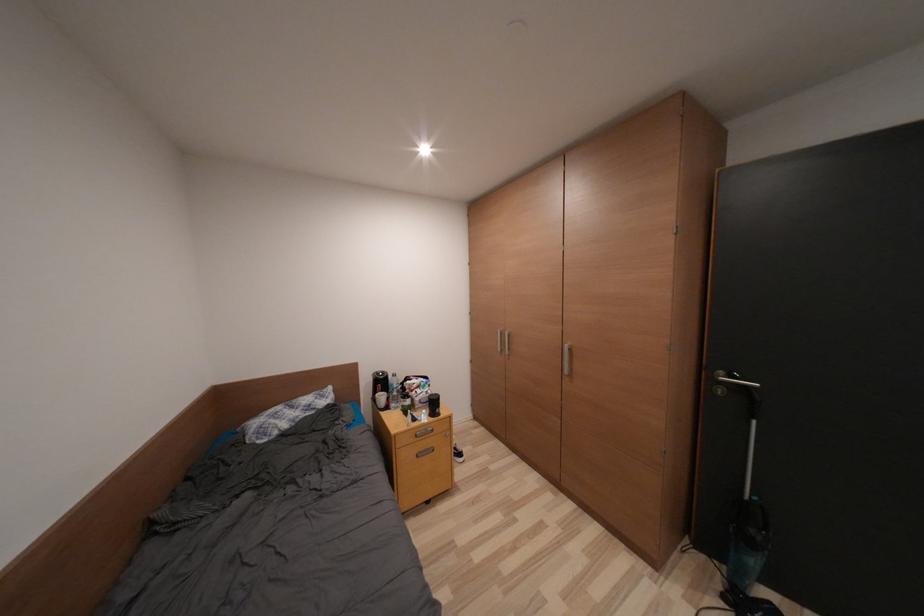
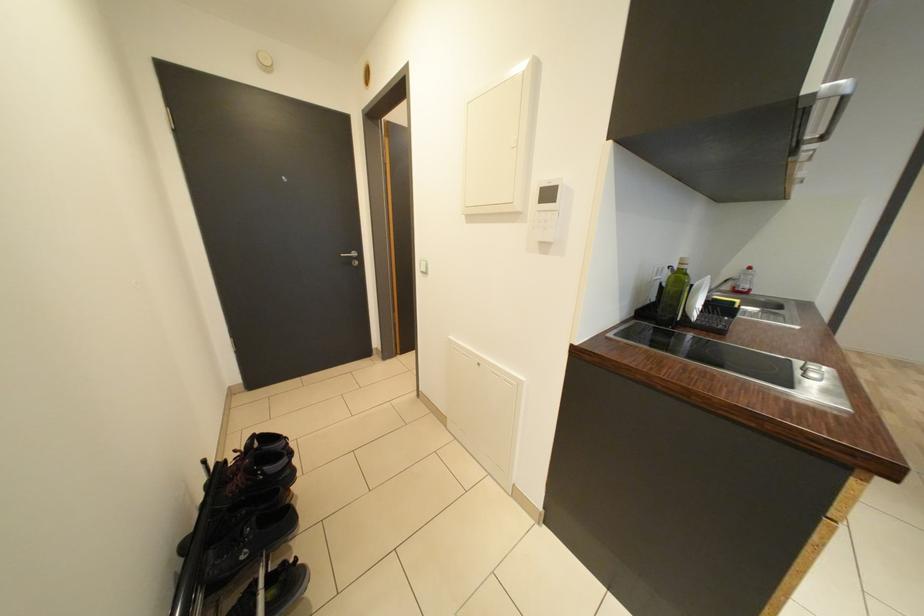
In a continuous first-person perspective shot, in which direction is the camera moving?

The cameraman walked toward right, forward.